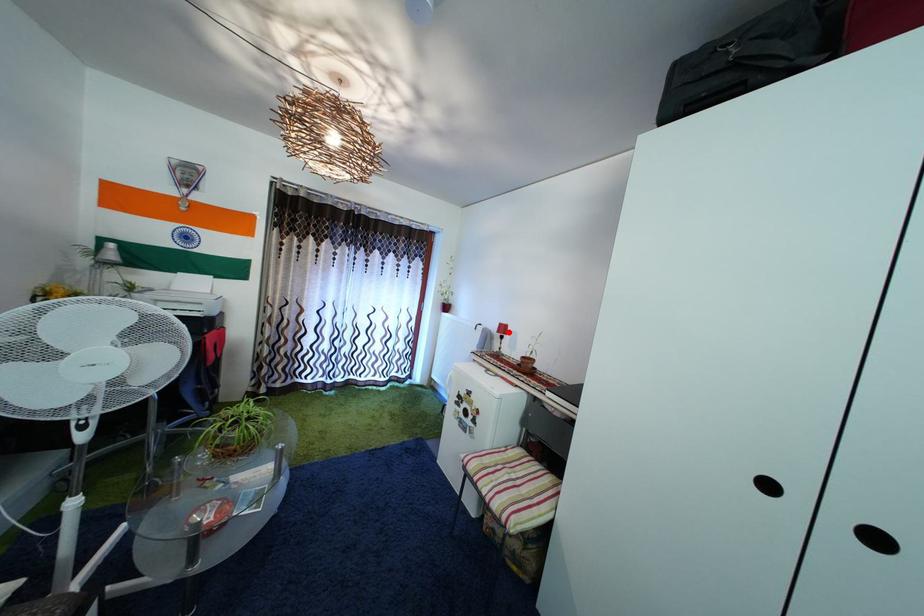
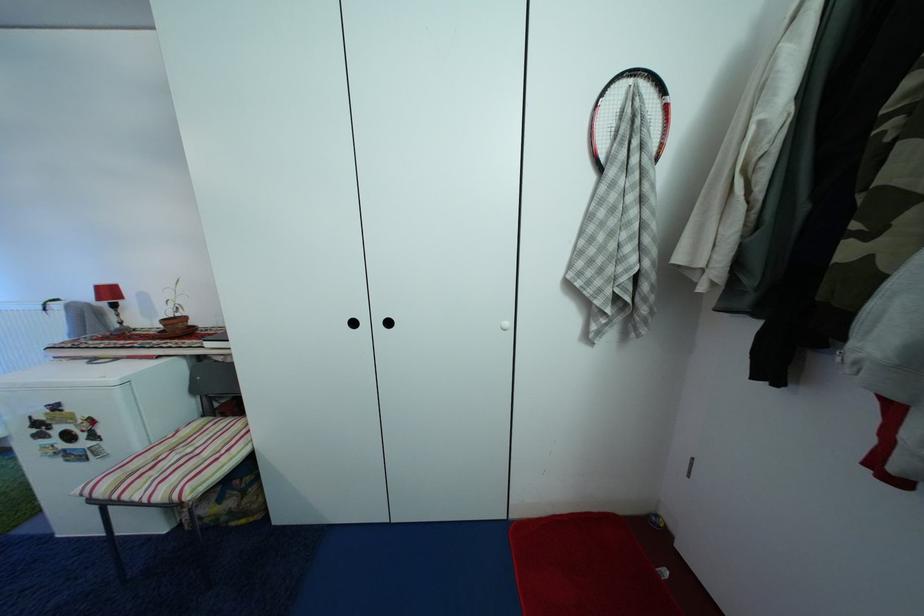
Locate, in the second image, the point that corresponds to the highlighted location in the first image.

(106, 294)